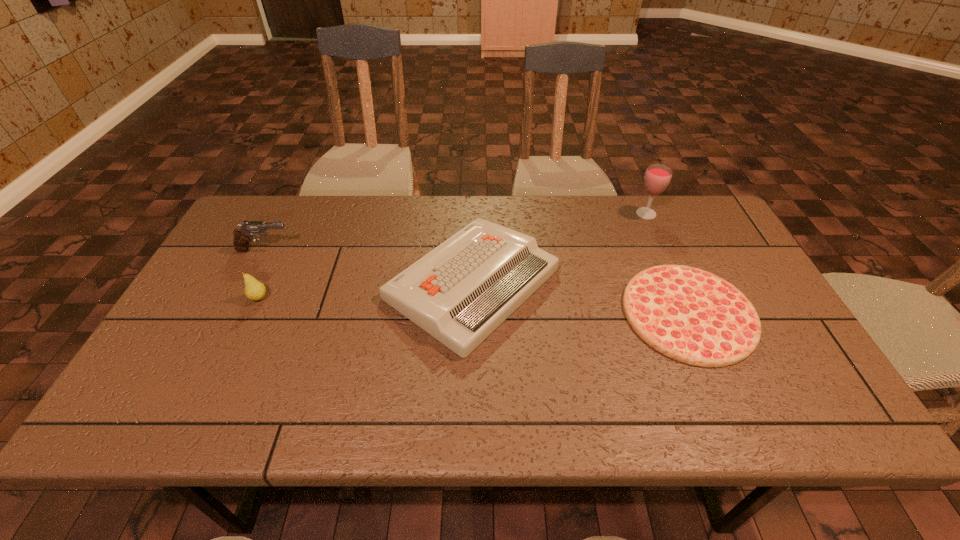
I want to click on vacant space located on the right of the computer keyboard, so click(x=630, y=284).

Where is `free space located 0.300m on the left of the pizza`? The width and height of the screenshot is (960, 540). free space located 0.300m on the left of the pizza is located at coordinates (507, 313).

I want to click on wineglass located at the far edge, so click(x=657, y=177).

You are a GUI agent. You are given a task and a screenshot of the screen. Output one action in this format:
    pyautogui.click(x=<x>, y=<y>)
    Task: Click on the computer keyboard located in the far edge section of the desktop
    
    Given the screenshot: What is the action you would take?
    pyautogui.click(x=461, y=291)

Locate an element on the screen. The image size is (960, 540). pistol present at the left edge is located at coordinates (242, 236).

Identify the location of pear that is at the left edge. The width and height of the screenshot is (960, 540). (254, 290).

This screenshot has height=540, width=960. I want to click on object that is at the right edge, so click(x=693, y=316).

Where is `vacant area at the far edge`? The width and height of the screenshot is (960, 540). vacant area at the far edge is located at coordinates (610, 198).

In the image, there is a desktop. Where is `vacant region at the near edge`? vacant region at the near edge is located at coordinates (234, 404).

Identify the location of blank space at the left edge of the desktop. (182, 362).